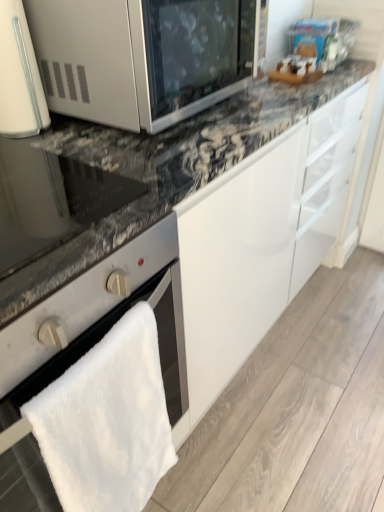
At what (x,y) coordinates should I click in order to perform the action: click on satin silver microwave at upper left. Please return your answer as a coordinate pair (x, y). This screenshot has height=512, width=384. Looking at the image, I should click on click(x=142, y=57).

Where is `white glossy microwave at upper left`? This screenshot has width=384, height=512. white glossy microwave at upper left is located at coordinates (19, 76).

This screenshot has height=512, width=384. I want to click on satin silver oven at lower left, so click(x=116, y=319).

Measure the distance between matte black oven at left and camera.

A distance of 53.30 centimeters exists between matte black oven at left and camera.

You are a GUI agent. You are given a task and a screenshot of the screen. Output one action in this format:
    pyautogui.click(x=<x>, y=<y>)
    Task: Click on the satin silver microwave at upper left
    
    Given the screenshot: What is the action you would take?
    pyautogui.click(x=142, y=57)

Does satin silver oven at lower left appear on the left side of white glossy microwave at upper left?

In fact, satin silver oven at lower left is to the right of white glossy microwave at upper left.

In terms of height, does satin silver oven at lower left look taller or shorter compared to white glossy microwave at upper left?

Clearly, satin silver oven at lower left is taller compared to white glossy microwave at upper left.

Does point (178, 326) come farther from viewer compared to point (3, 15)?

Yes, point (178, 326) is behind point (3, 15).

How distant is satin silver oven at lower left from white glossy microwave at upper left?

satin silver oven at lower left and white glossy microwave at upper left are 21.25 inches apart.

Which object is positioned more to the right, white glossy microwave at upper left or matte black oven at left?

matte black oven at left is more to the right.

Considering the sizes of white glossy microwave at upper left and matte black oven at left in the image, is white glossy microwave at upper left bigger or smaller than matte black oven at left?

In the image, white glossy microwave at upper left appears to be smaller than matte black oven at left.

From the image's perspective, which object appears higher, white glossy microwave at upper left or matte black oven at left?

white glossy microwave at upper left is shown above in the image.

Is satin silver oven at lower left taller or shorter than satin silver microwave at upper left?

satin silver oven at lower left is taller than satin silver microwave at upper left.

In terms of width, does satin silver oven at lower left look wider or thinner when compared to satin silver microwave at upper left?

Considering their sizes, satin silver oven at lower left looks broader than satin silver microwave at upper left.

Is the position of satin silver oven at lower left more distant than that of satin silver microwave at upper left?

No, satin silver oven at lower left is closer to the viewer.

Does satin silver microwave at upper left have a greater height compared to matte black oven at left?

Yes.

Based on the photo, from the image's perspective, is satin silver microwave at upper left positioned above or below matte black oven at left?

satin silver microwave at upper left is situated higher than matte black oven at left in the image.

Does satin silver microwave at upper left have a smaller size compared to matte black oven at left?

Actually, satin silver microwave at upper left might be larger than matte black oven at left.

How different are the orientations of satin silver microwave at upper left and matte black oven at left in degrees?

0.784 degrees separate the facing orientations of satin silver microwave at upper left and matte black oven at left.

Can we say satin silver oven at lower left lies outside matte black oven at left?

Yes, satin silver oven at lower left is not within matte black oven at left.

Does point (97, 285) come closer to viewer compared to point (12, 200)?

Yes, it is in front of point (12, 200).

Is satin silver oven at lower left with matte black oven at left?

No, satin silver oven at lower left is not next to matte black oven at left.

Which of these two, satin silver oven at lower left or matte black oven at left, is bigger?

With larger size is satin silver oven at lower left.

Which of these two, white glossy microwave at upper left or satin silver microwave at upper left, stands taller?

With more height is white glossy microwave at upper left.

Looking at this image, is satin silver microwave at upper left a part of white glossy microwave at upper left?

No, satin silver microwave at upper left is not a part of white glossy microwave at upper left.

Which is behind, white glossy microwave at upper left or satin silver microwave at upper left?

white glossy microwave at upper left is more distant.

Image resolution: width=384 pixels, height=512 pixels. In order to click on microwave oven that is on the right side of white glossy microwave at upper left in this screenshot , I will do `click(142, 57)`.

How distant is matte black oven at left from satin silver microwave at upper left?

A distance of 30.22 centimeters exists between matte black oven at left and satin silver microwave at upper left.

Is matte black oven at left positioned with its back to satin silver microwave at upper left?

No.

Which is correct: matte black oven at left is inside satin silver microwave at upper left, or outside of it?

matte black oven at left is located beyond the bounds of satin silver microwave at upper left.

From a real-world perspective, is matte black oven at left above or below satin silver microwave at upper left?

In terms of real-world spatial position, matte black oven at left is below satin silver microwave at upper left.

Find the location of a particular element. oven that is on the right side of white glossy microwave at upper left is located at coordinates (116, 319).

Where is `appliance in front of the white glossy microwave at upper left`? appliance in front of the white glossy microwave at upper left is located at coordinates (51, 200).

Estimate the real-world distances between objects in this image. Which object is closer to white glossy microwave at upper left, satin silver oven at lower left or satin silver microwave at upper left?

satin silver microwave at upper left.

Which object lies nearer to the anchor point satin silver microwave at upper left, satin silver oven at lower left or white glossy microwave at upper left?

Among the two, white glossy microwave at upper left is located nearer to satin silver microwave at upper left.

From the image, which object appears to be farther from satin silver oven at lower left, matte black oven at left or white glossy microwave at upper left?

white glossy microwave at upper left is further to satin silver oven at lower left.

Estimate the real-world distances between objects in this image. Which object is further from matte black oven at left, satin silver oven at lower left or satin silver microwave at upper left?

satin silver microwave at upper left lies further to matte black oven at left than the other object.

From the image, which object appears to be nearer to white glossy microwave at upper left, matte black oven at left or satin silver microwave at upper left?

The object closer to white glossy microwave at upper left is satin silver microwave at upper left.

Considering their positions, is white glossy microwave at upper left positioned closer to satin silver oven at lower left than satin silver microwave at upper left?

satin silver microwave at upper left is closer to satin silver oven at lower left.

When comparing their distances from satin silver oven at lower left, does matte black oven at left or satin silver microwave at upper left seem further?

Based on the image, satin silver microwave at upper left appears to be further to satin silver oven at lower left.

Which object lies further to the anchor point matte black oven at left, white glossy microwave at upper left or satin silver oven at lower left?

white glossy microwave at upper left is further to matte black oven at left.

This screenshot has height=512, width=384. What are the coordinates of `appliance between white glossy microwave at upper left and satin silver oven at lower left from top to bottom` in the screenshot? It's located at (51, 200).

Find the location of a particular element. The width and height of the screenshot is (384, 512). home appliance between satin silver microwave at upper left and matte black oven at left vertically is located at coordinates (19, 76).

You are a GUI agent. You are given a task and a screenshot of the screen. Output one action in this format:
    pyautogui.click(x=<x>, y=<y>)
    Task: Click on the appliance between satin silver microwave at upper left and satin silver oven at lower left vertically
    
    Given the screenshot: What is the action you would take?
    pyautogui.click(x=51, y=200)

At what (x,y) coordinates should I click in order to perform the action: click on home appliance between satin silver microwave at upper left and satin silver oven at lower left in the vertical direction. Please return your answer as a coordinate pair (x, y). Image resolution: width=384 pixels, height=512 pixels. Looking at the image, I should click on (19, 76).